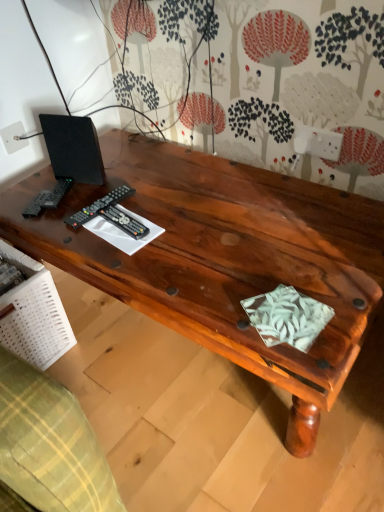
Question: Could you tell me if black plastic remote at left, the second control viewed from the right, is turned towards black matte speaker at upper left?

Choices:
 (A) no
 (B) yes

Answer: (A)

Question: Does black plastic remote at left, which appears as the 1th control when viewed from the left, have a greater width compared to black matte speaker at upper left?

Choices:
 (A) no
 (B) yes

Answer: (B)

Question: Considering the relative positions of black plastic remote at left, the second control viewed from the right, and black matte speaker at upper left in the image provided, is black plastic remote at left, the second control viewed from the right, to the right of black matte speaker at upper left from the viewer's perspective?

Choices:
 (A) no
 (B) yes

Answer: (B)

Question: Can you confirm if black plastic remote at left, which appears as the 1th control when viewed from the left, is positioned to the left of black matte speaker at upper left?

Choices:
 (A) no
 (B) yes

Answer: (A)

Question: Is black plastic remote at left, the second control viewed from the right, further to the viewer compared to black matte speaker at upper left?

Choices:
 (A) yes
 (B) no

Answer: (B)

Question: Do you think black matte speaker at upper left is within shiny brown wood desk at center, or outside of it?

Choices:
 (A) outside
 (B) inside

Answer: (A)

Question: From their relative heights in the image, would you say black matte speaker at upper left is taller or shorter than shiny brown wood desk at center?

Choices:
 (A) tall
 (B) short

Answer: (B)

Question: Does point (79, 172) appear closer or farther from the camera than point (375, 243)?

Choices:
 (A) closer
 (B) farther

Answer: (B)

Question: From a real-world perspective, is black matte speaker at upper left physically located above or below shiny brown wood desk at center?

Choices:
 (A) below
 (B) above

Answer: (B)

Question: In terms of width, does black plastic remote at center, arranged as the 2th control when viewed from the left, look wider or thinner when compared to shiny brown wood desk at center?

Choices:
 (A) wide
 (B) thin

Answer: (B)

Question: From the image's perspective, is black plastic remote at center, acting as the first control starting from the right, positioned above or below shiny brown wood desk at center?

Choices:
 (A) above
 (B) below

Answer: (A)

Question: Considering the positions of point (122, 211) and point (382, 240), is point (122, 211) closer or farther from the camera than point (382, 240)?

Choices:
 (A) farther
 (B) closer

Answer: (A)

Question: Is black plastic remote at center, arranged as the 2th control when viewed from the left, to the left or to the right of shiny brown wood desk at center in the image?

Choices:
 (A) right
 (B) left

Answer: (B)

Question: Considering the positions of black plastic remote at left, the second control viewed from the right, and shiny brown wood desk at center in the image, is black plastic remote at left, the second control viewed from the right, taller or shorter than shiny brown wood desk at center?

Choices:
 (A) short
 (B) tall

Answer: (A)

Question: From a real-world perspective, relative to shiny brown wood desk at center, is black plastic remote at left, which appears as the 1th control when viewed from the left, vertically above or below?

Choices:
 (A) above
 (B) below

Answer: (A)